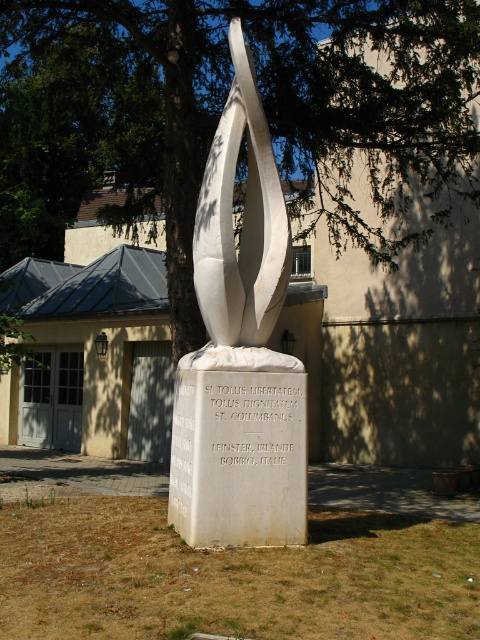
Does green leafy tree at center have a greater height compared to white polished stone sculpture at center?

Answer: Correct, green leafy tree at center is much taller as white polished stone sculpture at center.

Who is positioned more to the right, green leafy tree at center or white polished stone sculpture at center?

Positioned to the right is white polished stone sculpture at center.

Between point (425, 19) and point (266, 195), which one is positioned in front?

Point (266, 195)

This screenshot has height=640, width=480. In order to click on green leafy tree at center in this screenshot , I will do `click(220, 108)`.